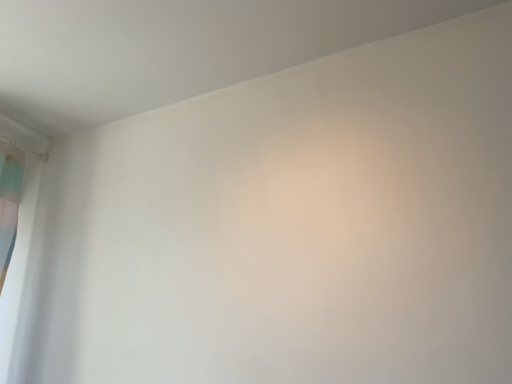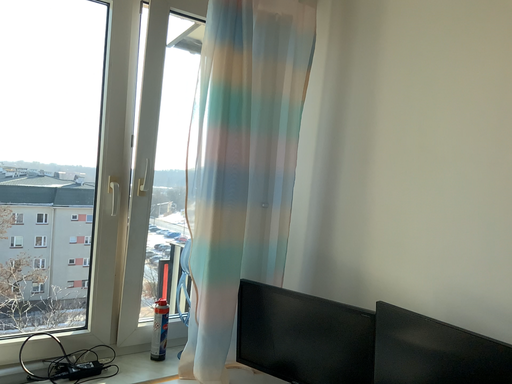
Question: How did the camera likely rotate when shooting the video?

Choices:
 (A) rotated downward
 (B) rotated upward

Answer: (A)